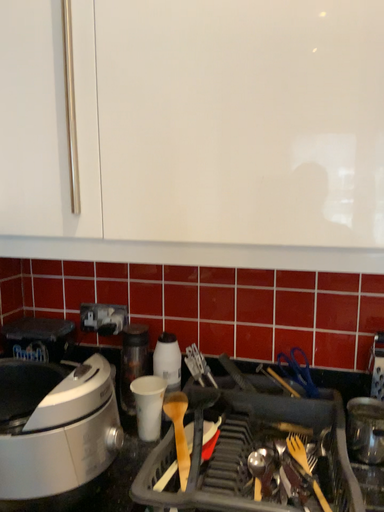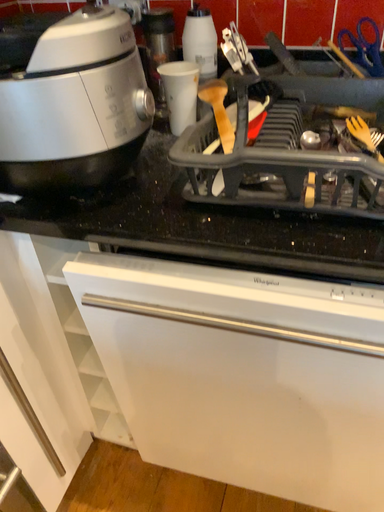
Question: Which way did the camera rotate in the video?

Choices:
 (A) rotated downward
 (B) rotated upward

Answer: (A)